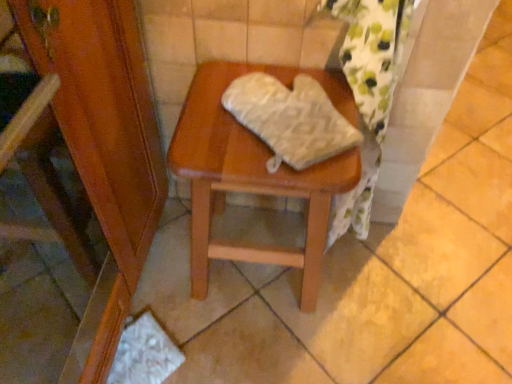
Image resolution: width=512 pixels, height=384 pixels. I want to click on free space to the left of white textured oven mitt at center, so click(x=209, y=124).